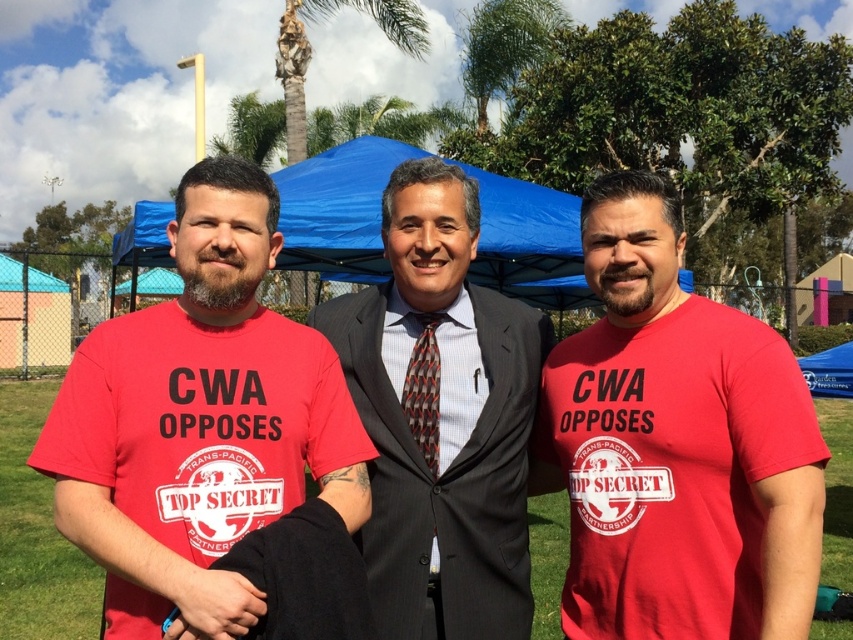
Who is positioned more to the left, dark gray textured suit at center or brown textured tie at center?

Positioned to the left is brown textured tie at center.

The height and width of the screenshot is (640, 853). What do you see at coordinates (457, 378) in the screenshot?
I see `dark gray textured suit at center` at bounding box center [457, 378].

The height and width of the screenshot is (640, 853). In order to click on dark gray textured suit at center in this screenshot , I will do `click(457, 378)`.

Between point (381, 257) and point (447, 323), which one is positioned in front?

Point (447, 323) is in front.

Is blue fabric canopy at center shorter than dark gray textured suit at center?

No.

This screenshot has height=640, width=853. I want to click on blue fabric canopy at center, so click(338, 209).

Identify the location of blue fabric canopy at center. The image size is (853, 640). (338, 209).

Which is more to the left, matte red t-shirt at center or blue fabric canopy at center?

blue fabric canopy at center

This screenshot has height=640, width=853. What do you see at coordinates (676, 445) in the screenshot? I see `matte red t-shirt at center` at bounding box center [676, 445].

The height and width of the screenshot is (640, 853). What do you see at coordinates (676, 445) in the screenshot? I see `matte red t-shirt at center` at bounding box center [676, 445].

Image resolution: width=853 pixels, height=640 pixels. Identify the location of matte red t-shirt at center. (676, 445).